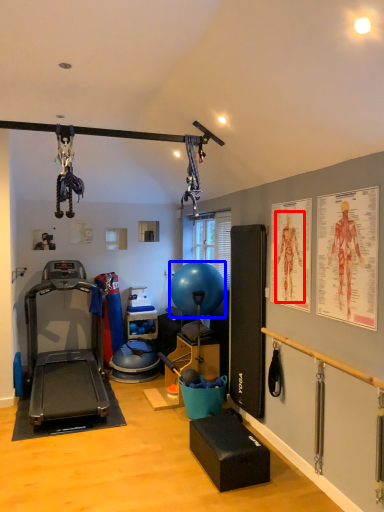
Question: Which object is closer to the camera taking this photo, person (highlighted by a red box) or balloon (highlighted by a blue box)?

Choices:
 (A) person
 (B) balloon

Answer: (A)